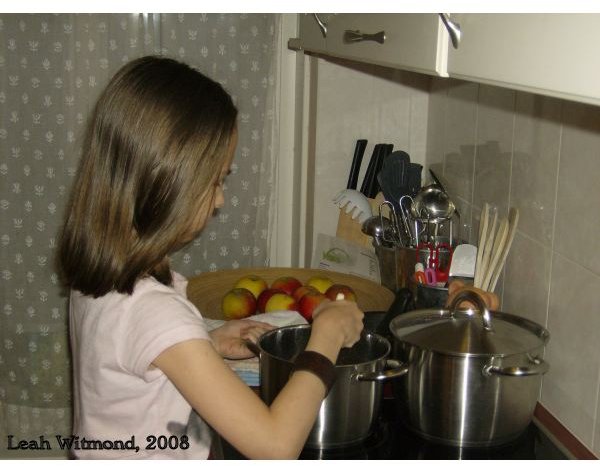
Identify the location of pot. The width and height of the screenshot is (600, 466). (475, 372), (346, 394).